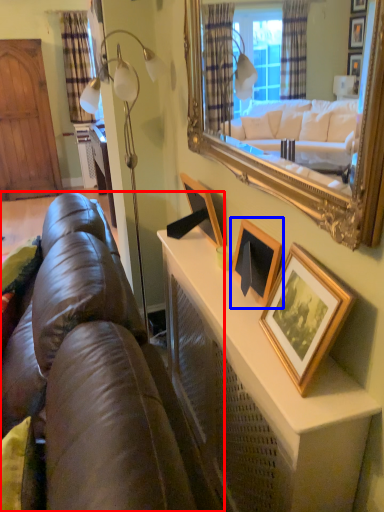
Question: Which of the following is the farthest to the observer, studio couch (highlighted by a red box) or picture frame (highlighted by a blue box)?

Choices:
 (A) studio couch
 (B) picture frame

Answer: (B)